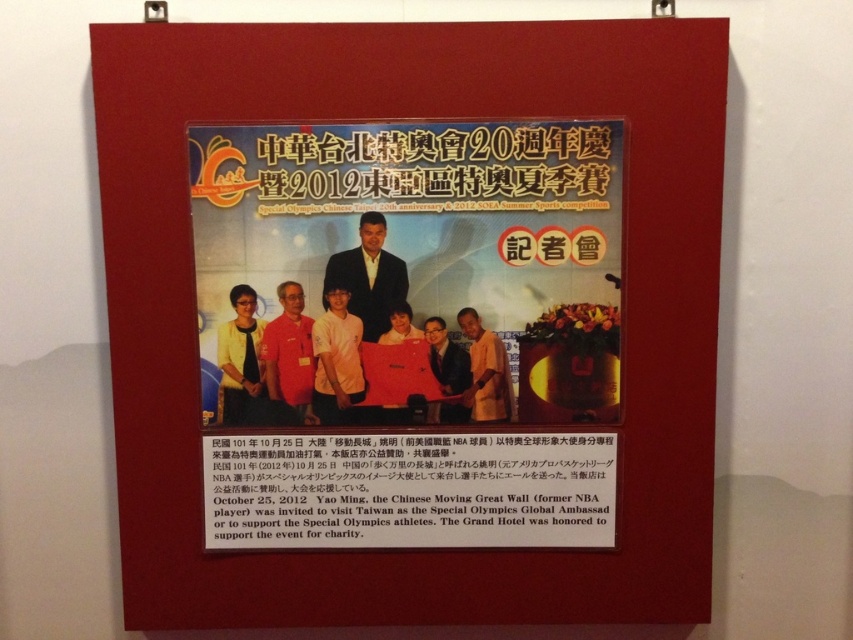
You are an event organizer who needs to place a black paper at center and a matte red laptop at center on the display board. According to the image, which object should be placed to the left to ensure proper alignment?

The matte red laptop at center should be placed to the left of the black paper at center because the black paper at center is positioned on the right side of the matte red laptop at center.

You are organizing a photo shoot for a promotional campaign and need to ensure that the orange cotton shirt at center and the matte red laptop at center in the display board are spaced exactly 5 centimeters apart. Based on the scene description, will you need to adjust their positions?

The orange cotton shirt at center and the matte red laptop at center are currently 5.15 centimeters apart. Since this is slightly more than the required 5 centimeters, you would need to move them closer by 0.15 centimeters to meet the exact spacing requirement.

You are an event organizer who needs to place a 12 inch wide decorative item on the framed display board. The board has the black paper at center and the matte red laptop at center. Which object can you place the item next to without overlapping?

The black paper at center is larger in size than the matte red laptop at center, so placing the 12 inch wide decorative item next to the black paper at center would be more feasible as it has more space available around it.